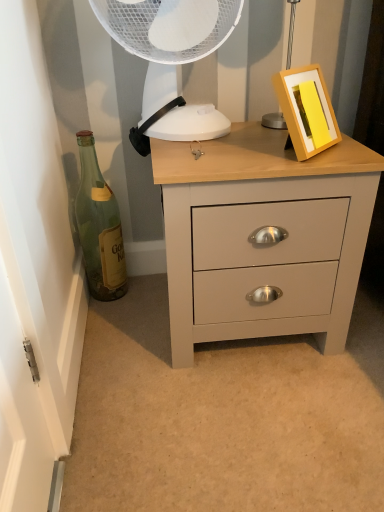
Where is `vacant space in between matte gray chest of drawers at center and green glass bottle at left`? vacant space in between matte gray chest of drawers at center and green glass bottle at left is located at coordinates (138, 314).